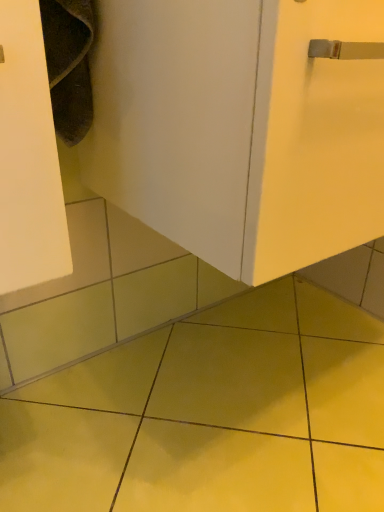
The height and width of the screenshot is (512, 384). I want to click on white matte door at center, so click(240, 128).

What is the approximate height of white matte door at center?

13.54 inches.

What do you see at coordinates (240, 128) in the screenshot? This screenshot has width=384, height=512. I see `white matte door at center` at bounding box center [240, 128].

What do you see at coordinates (210, 415) in the screenshot? I see `yellow glossy tile at center` at bounding box center [210, 415].

I want to click on yellow glossy tile at center, so click(210, 415).

Measure the distance between point (278, 350) and camera.

Point (278, 350) is 3.50 feet away from camera.

Find the location of a particular element. Image resolution: width=384 pixels, height=512 pixels. white matte door at center is located at coordinates (240, 128).

In the scene shown: Considering the relative positions of yellow glossy tile at center and white matte door at center in the image provided, is yellow glossy tile at center to the right of white matte door at center from the viewer's perspective?

Incorrect, yellow glossy tile at center is not on the right side of white matte door at center.

Which object is closer to the camera, yellow glossy tile at center or white matte door at center?

white matte door at center is in front.

Which is less distant, (381, 368) or (383, 144)?

The point (383, 144) is closer to the camera.

From the image's perspective, is yellow glossy tile at center located beneath white matte door at center?

Correct, yellow glossy tile at center appears lower than white matte door at center in the image.

From a real-world perspective, which is physically above, yellow glossy tile at center or white matte door at center?

From a 3D spatial view, white matte door at center is above.

Which object is thinner, yellow glossy tile at center or white matte door at center?

white matte door at center.

Considering the sizes of objects yellow glossy tile at center and white matte door at center in the image provided, who is shorter, yellow glossy tile at center or white matte door at center?

yellow glossy tile at center is shorter.

Is yellow glossy tile at center bigger or smaller than white matte door at center?

In the image, yellow glossy tile at center appears to be smaller than white matte door at center.

Is yellow glossy tile at center spatially inside white matte door at center, or outside of it?

yellow glossy tile at center exists outside the volume of white matte door at center.

Would you consider yellow glossy tile at center to be distant from white matte door at center?

They are positioned close to each other.

Is yellow glossy tile at center aimed at white matte door at center?

No.

Measure the distance between yellow glossy tile at center and white matte door at center.

They are 21.02 inches apart.

This screenshot has width=384, height=512. Find the location of `ceramic tile below the white matte door at center (from the image's perspective)`. ceramic tile below the white matte door at center (from the image's perspective) is located at coordinates (210, 415).

Considering the relative positions of white matte door at center and yellow glossy tile at center in the image provided, is white matte door at center to the right of yellow glossy tile at center from the viewer's perspective?

Yes, white matte door at center is to the right of yellow glossy tile at center.

Which object is closer to the camera taking this photo, white matte door at center or yellow glossy tile at center?

white matte door at center.

Does point (147, 88) lie behind point (159, 420)?

No, (147, 88) is closer to viewer.

From the image's perspective, is white matte door at center located above or below yellow glossy tile at center?

white matte door at center is situated higher than yellow glossy tile at center in the image.

From a real-world perspective, is white matte door at center on yellow glossy tile at center?

Indeed, from a real-world perspective, white matte door at center stands above yellow glossy tile at center.

Which of these two, white matte door at center or yellow glossy tile at center, is thinner?

Thinner between the two is white matte door at center.

Consider the image. From their relative heights in the image, would you say white matte door at center is taller or shorter than yellow glossy tile at center?

Clearly, white matte door at center is taller compared to yellow glossy tile at center.

Can you confirm if white matte door at center is bigger than yellow glossy tile at center?

Yes, white matte door at center is bigger than yellow glossy tile at center.

Does white matte door at center contain yellow glossy tile at center?

No, yellow glossy tile at center is not a part of white matte door at center.

In the scene shown: Is white matte door at center directly adjacent to yellow glossy tile at center?

white matte door at center and yellow glossy tile at center are clearly separated.

Could you tell me if white matte door at center is turned towards yellow glossy tile at center?

No, white matte door at center is not oriented towards yellow glossy tile at center.

What's the angular difference between white matte door at center and yellow glossy tile at center's facing directions?

The facing directions of white matte door at center and yellow glossy tile at center are 89.6 degrees apart.

From the picture: Measure the distance from white matte door at center to yellow glossy tile at center.

They are 21.02 inches apart.

Find the location of a particular element. Image resolution: width=384 pixels, height=512 pixels. ceramic tile that appears below the white matte door at center (from the image's perspective) is located at coordinates (210, 415).

Where is `door in front of the yellow glossy tile at center`? Image resolution: width=384 pixels, height=512 pixels. door in front of the yellow glossy tile at center is located at coordinates (240, 128).

Where is `ceramic tile that is under the white matte door at center (from a real-world perspective)`? ceramic tile that is under the white matte door at center (from a real-world perspective) is located at coordinates (210, 415).